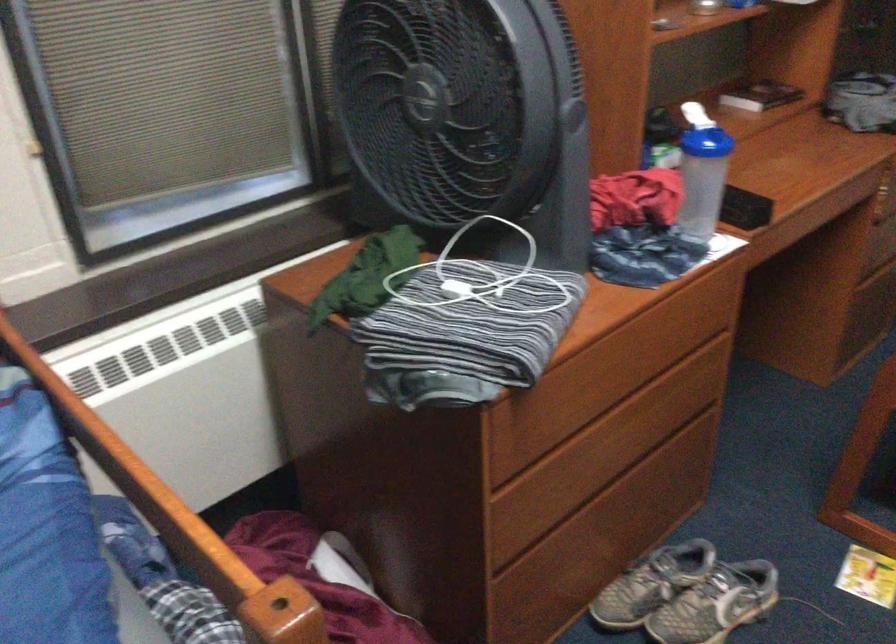
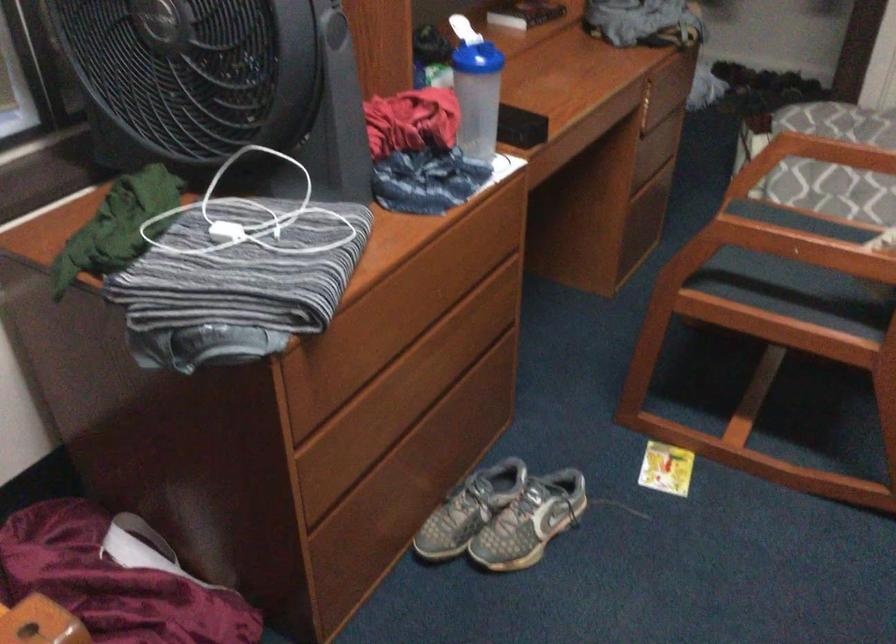
Where in the second image is the point corresponding to (x=510, y=466) from the first image?

(312, 415)